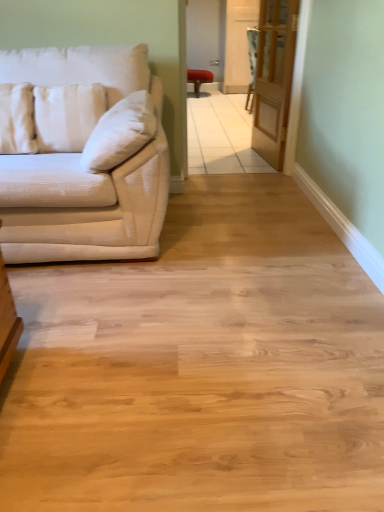
What do you see at coordinates (17, 119) in the screenshot? I see `white fabric pillow at left, placed as the 1th pillow when sorted from left to right` at bounding box center [17, 119].

Locate an element on the screen. This screenshot has width=384, height=512. white striped pillow at left, the 1th pillow from the right is located at coordinates (67, 115).

In order to face matte white couch at left, should I rotate leftwards or rightwards?

Turn left approximately 17.095 degrees to face it.

At what (x,y) coordinates should I click in order to perform the action: click on white fabric pillow at left, the 2th pillow when ordered from right to left. Please return your answer as a coordinate pair (x, y). Looking at the image, I should click on (17, 119).

Does matte white couch at left come behind white striped pillow at left, the 1th pillow from the right?

No, matte white couch at left is closer to the camera.

From a real-world perspective, relative to white striped pillow at left, the 1th pillow from the right, is matte white couch at left vertically above or below?

Clearly, from a real-world perspective, matte white couch at left is below white striped pillow at left, the 1th pillow from the right.

Is matte white couch at left surrounding white striped pillow at left, the 1th pillow from the right?

Yes, white striped pillow at left, the 1th pillow from the right, is a part of matte white couch at left.

Is point (103, 259) closer or farther from the camera than point (93, 96)?

Point (103, 259) appears to be closer to the viewer than point (93, 96).

Who is shorter, white striped pillow at left, which is the second pillow in left-to-right order, or matte red stool at center?

With less height is matte red stool at center.

Is white striped pillow at left, the 1th pillow from the right, smaller than matte red stool at center?

Correct, white striped pillow at left, the 1th pillow from the right, occupies less space than matte red stool at center.

Locate an element on the screen. The height and width of the screenshot is (512, 384). chair on the right of white striped pillow at left, the 1th pillow from the right is located at coordinates point(199,79).

Considering the sizes of objects white striped pillow at left, the 1th pillow from the right, and matte red stool at center in the image provided, who is wider, white striped pillow at left, the 1th pillow from the right, or matte red stool at center?

matte red stool at center is wider.

Considering the positions of point (7, 118) and point (250, 100), is point (7, 118) closer or farther from the camera than point (250, 100)?

Point (7, 118) is closer to the camera than point (250, 100).

Looking at this image, which of these two, white fabric pillow at left, placed as the 1th pillow when sorted from left to right, or velvet-like beige armchair at center, is bigger?

Bigger between the two is velvet-like beige armchair at center.

Is white fabric pillow at left, the 2th pillow when ordered from right to left, taller than velvet-like beige armchair at center?

No.

From a real-world perspective, is matte white couch at left positioned under matte red stool at center based on gravity?

No, from a real-world perspective, matte white couch at left is not beneath matte red stool at center.

Consider the image. Does matte white couch at left lie in front of matte red stool at center?

Yes, the depth of matte white couch at left is less than that of matte red stool at center.

Which of these two, matte white couch at left or matte red stool at center, is smaller?

matte red stool at center is smaller.

Is matte white couch at left outside of matte red stool at center?

Yes.

Is white striped pillow at left, which is the second pillow in left-to-right order, far away from velvet-like beige armchair at center?

white striped pillow at left, which is the second pillow in left-to-right order, is positioned a significant distance from velvet-like beige armchair at center.

From the image's perspective, who appears lower, white striped pillow at left, the 1th pillow from the right, or velvet-like beige armchair at center?

From the image's view, white striped pillow at left, the 1th pillow from the right, is below.

This screenshot has height=512, width=384. Identify the location of armchair on the right of the white striped pillow at left, the 1th pillow from the right. (252, 64).

I want to click on the 2nd pillow directly above the matte red stool at center (from a real-world perspective), so click(17, 119).

From the image's perspective, would you say white fabric pillow at left, the 2th pillow when ordered from right to left, is positioned over matte red stool at center?

No, from the image's perspective, white fabric pillow at left, the 2th pillow when ordered from right to left, is not above matte red stool at center.

Is white fabric pillow at left, the 2th pillow when ordered from right to left, completely or partially outside of matte red stool at center?

Absolutely, white fabric pillow at left, the 2th pillow when ordered from right to left, is external to matte red stool at center.

Is white fabric pillow at left, placed as the 1th pillow when sorted from left to right, to the left of matte red stool at center from the viewer's perspective?

Indeed, white fabric pillow at left, placed as the 1th pillow when sorted from left to right, is positioned on the left side of matte red stool at center.

Can white fabric pillow at left, the 2th pillow when ordered from right to left, be found inside white striped pillow at left, the 1th pillow from the right?

That's incorrect, white fabric pillow at left, the 2th pillow when ordered from right to left, is not inside white striped pillow at left, the 1th pillow from the right.

Considering the sizes of objects white striped pillow at left, the 1th pillow from the right, and white fabric pillow at left, placed as the 1th pillow when sorted from left to right, in the image provided, who is thinner, white striped pillow at left, the 1th pillow from the right, or white fabric pillow at left, placed as the 1th pillow when sorted from left to right,?

With smaller width is white striped pillow at left, the 1th pillow from the right.

Which is less distant, (34,103) or (10,106)?

Point (34,103) appears to be farther away from the viewer than point (10,106).

From a real-world perspective, which pillow is the 1st one above the matte white couch at left? Please provide its 2D coordinates.

[(67, 115)]

Where is `chair on the right side of white striped pillow at left, which is the second pillow in left-to-right order`? The height and width of the screenshot is (512, 384). chair on the right side of white striped pillow at left, which is the second pillow in left-to-right order is located at coordinates (199, 79).

Estimate the real-world distances between objects in this image. Which object is closer to velvet-like beige armchair at center, matte red stool at center or white striped pillow at left, which is the second pillow in left-to-right order?

white striped pillow at left, which is the second pillow in left-to-right order.

Based on their spatial positions, is velvet-like beige armchair at center or matte red stool at center further from white fabric pillow at left, the 2th pillow when ordered from right to left?

matte red stool at center.

Consider the image. Looking at the image, which one is located further to velvet-like beige armchair at center, white fabric pillow at left, the 2th pillow when ordered from right to left, or matte white couch at left?

Among the two, white fabric pillow at left, the 2th pillow when ordered from right to left, is located further to velvet-like beige armchair at center.

From the image, which object appears to be farther from clear glass door at center, matte red stool at center or white fabric pillow at left, the 2th pillow when ordered from right to left?

Based on the image, matte red stool at center appears to be further to clear glass door at center.

When comparing their distances from matte red stool at center, does matte white couch at left or velvet-like beige armchair at center seem closer?

Among the two, velvet-like beige armchair at center is located nearer to matte red stool at center.

From the image, which object appears to be farther from velvet-like beige armchair at center, white striped pillow at left, which is the second pillow in left-to-right order, or clear glass door at center?

white striped pillow at left, which is the second pillow in left-to-right order, is further to velvet-like beige armchair at center.

Considering their positions, is matte white couch at left positioned further to clear glass door at center than white fabric pillow at left, the 2th pillow when ordered from right to left?

white fabric pillow at left, the 2th pillow when ordered from right to left, is positioned further to the anchor clear glass door at center.

Based on their spatial positions, is matte white couch at left or matte red stool at center further from white striped pillow at left, which is the second pillow in left-to-right order?

Based on the image, matte red stool at center appears to be further to white striped pillow at left, which is the second pillow in left-to-right order.

This screenshot has height=512, width=384. Identify the location of pillow located between white fabric pillow at left, the 2th pillow when ordered from right to left, and matte red stool at center in the depth direction. (67, 115).

Identify the location of armchair between matte white couch at left and matte red stool at center from front to back. The image size is (384, 512). click(x=252, y=64).

Find the location of a particular element. This screenshot has height=512, width=384. armchair between white fabric pillow at left, the 2th pillow when ordered from right to left, and matte red stool at center in the front-back direction is located at coordinates (252, 64).

You are a GUI agent. You are given a task and a screenshot of the screen. Output one action in this format:
    pyautogui.click(x=<x>, y=<y>)
    Task: Click on the pillow between white fabric pillow at left, placed as the 1th pillow when sorted from left to right, and clear glass door at center, in the horizontal direction
    The image size is (384, 512).
    Given the screenshot: What is the action you would take?
    pyautogui.click(x=67, y=115)